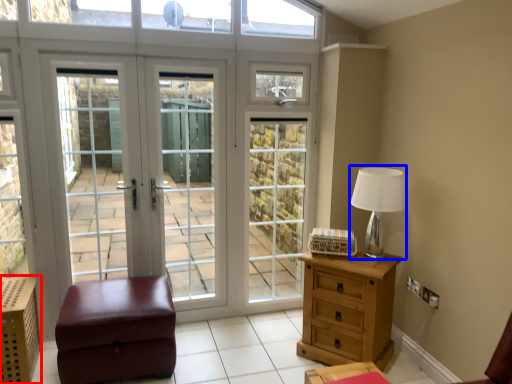
Question: Which object is further to the camera taking this photo, crate (highlighted by a red box) or table lamp (highlighted by a blue box)?

Choices:
 (A) crate
 (B) table lamp

Answer: (B)